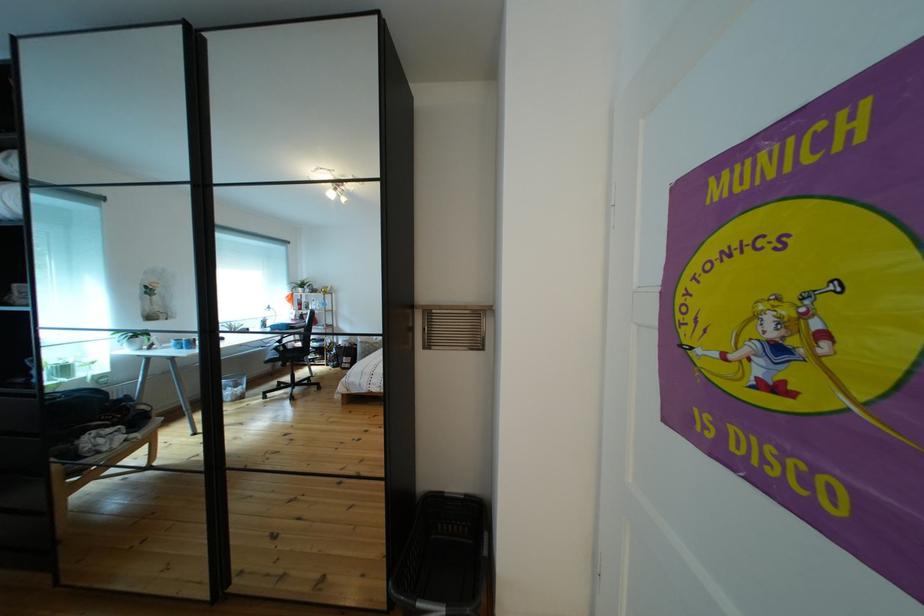
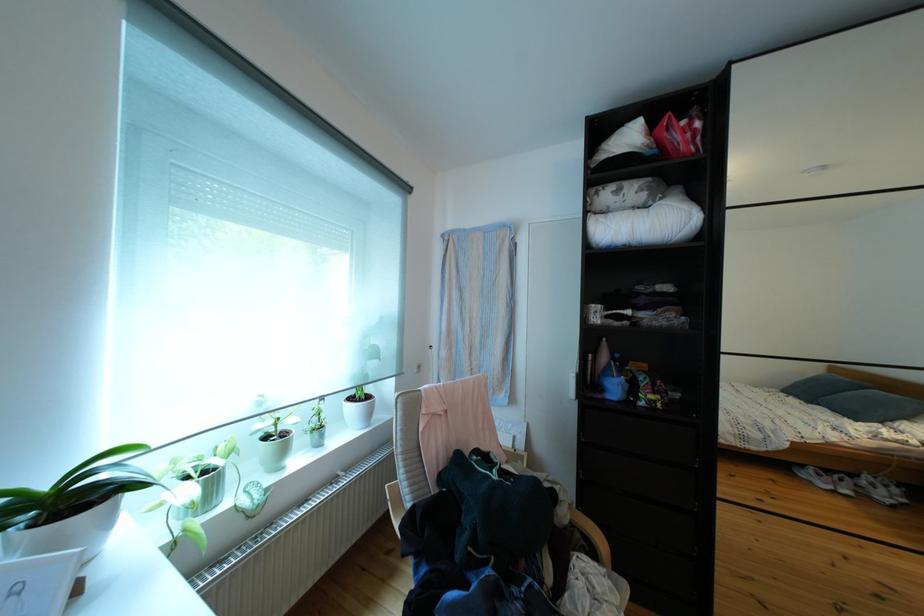
Question: What movement of the cameraman would produce the second image?

Choices:
 (A) Left
 (B) Right
 (C) Forward
 (D) Backward

Answer: (A)